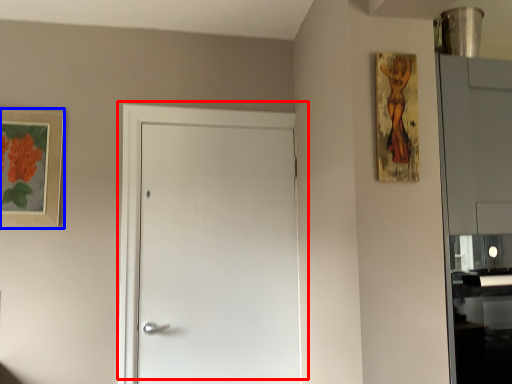
Question: Which point is further to the camera, door (highlighted by a red box) or picture frame (highlighted by a blue box)?

Choices:
 (A) door
 (B) picture frame

Answer: (A)